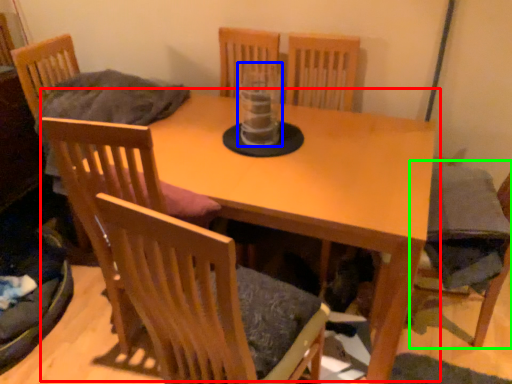
Question: Based on their relative distances, which object is nearer to table (highlighted by a red box)? Choose from glass vase (highlighted by a blue box) and armchair (highlighted by a green box).

Choices:
 (A) glass vase
 (B) armchair

Answer: (A)